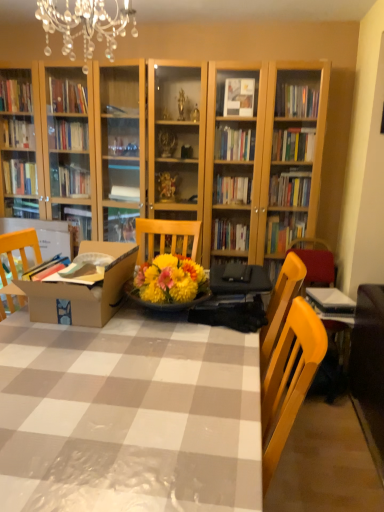
Question: Is crystal chandelier at upper center completely or partially inside brown cardboard box at center?

Choices:
 (A) no
 (B) yes

Answer: (A)

Question: Considering the relative sizes of brown cardboard box at center and crystal chandelier at upper center in the image provided, is brown cardboard box at center wider than crystal chandelier at upper center?

Choices:
 (A) no
 (B) yes

Answer: (B)

Question: Is brown cardboard box at center placed right next to crystal chandelier at upper center?

Choices:
 (A) no
 (B) yes

Answer: (A)

Question: From the image's perspective, is brown cardboard box at center over crystal chandelier at upper center?

Choices:
 (A) yes
 (B) no

Answer: (B)

Question: Is there a large distance between brown cardboard box at center and crystal chandelier at upper center?

Choices:
 (A) no
 (B) yes

Answer: (B)

Question: Would you say crystal chandelier at upper center is inside or outside wooden table at center?

Choices:
 (A) inside
 (B) outside

Answer: (B)

Question: Is crystal chandelier at upper center bigger or smaller than wooden table at center?

Choices:
 (A) big
 (B) small

Answer: (B)

Question: Relative to wooden table at center, is crystal chandelier at upper center in front or behind?

Choices:
 (A) front
 (B) behind

Answer: (B)

Question: From a real-world perspective, is crystal chandelier at upper center above or below wooden table at center?

Choices:
 (A) below
 (B) above

Answer: (B)

Question: From a real-world perspective, is brown cardboard box at center above or below crystal chandelier at upper center?

Choices:
 (A) below
 (B) above

Answer: (A)

Question: Looking at their shapes, would you say brown cardboard box at center is wider or thinner than crystal chandelier at upper center?

Choices:
 (A) wide
 (B) thin

Answer: (A)

Question: Considering the positions of point (72, 303) and point (109, 33), is point (72, 303) closer or farther from the camera than point (109, 33)?

Choices:
 (A) farther
 (B) closer

Answer: (B)

Question: From the image's perspective, relative to crystal chandelier at upper center, is brown cardboard box at center above or below?

Choices:
 (A) above
 (B) below

Answer: (B)

Question: From their relative heights in the image, would you say yellow wood chair at right is taller or shorter than crystal chandelier at upper center?

Choices:
 (A) tall
 (B) short

Answer: (A)

Question: Is yellow wood chair at right bigger or smaller than crystal chandelier at upper center?

Choices:
 (A) small
 (B) big

Answer: (B)